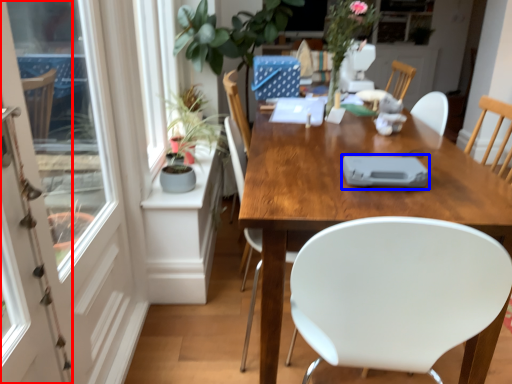
Question: Which object appears farthest to the camera in this image, screen door (highlighted by a red box) or tableware (highlighted by a blue box)?

Choices:
 (A) screen door
 (B) tableware

Answer: (B)